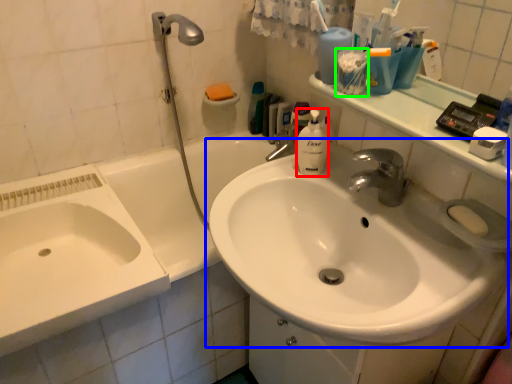
Question: Which object is the farthest from cleaning product (highlighted by a red box)? Choose among these: sink (highlighted by a blue box) or mouthwash (highlighted by a green box).

Choices:
 (A) sink
 (B) mouthwash

Answer: (A)